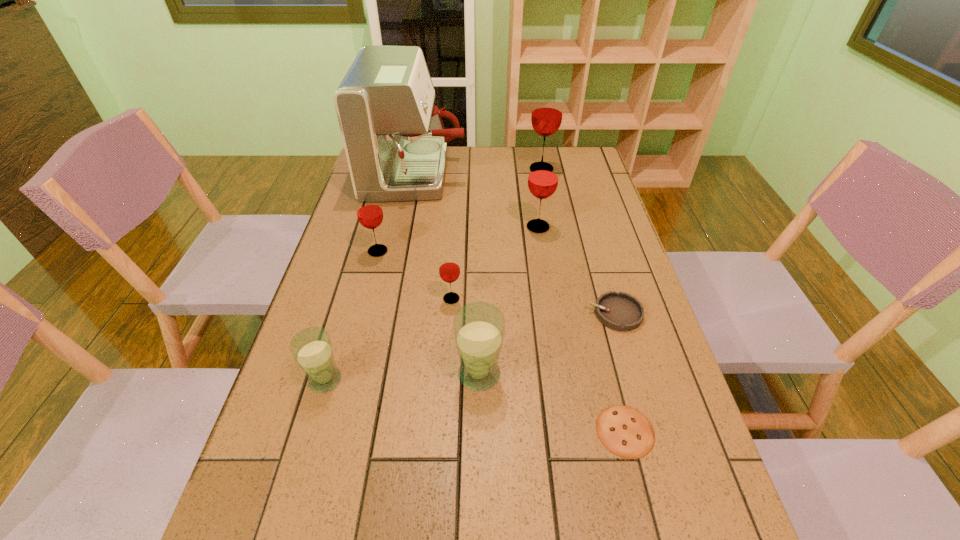
Locate an element on the screen. This screenshot has height=540, width=960. the third nearest glass is located at coordinates (449, 269).

This screenshot has width=960, height=540. In order to click on the smaller blue glass in this screenshot , I will do `click(312, 349)`.

At what (x,y) coordinates should I click in order to perform the action: click on the eighth tallest object. Please return your answer as a coordinate pair (x, y). This screenshot has height=540, width=960. Looking at the image, I should click on (621, 311).

In order to click on gray ashtray in this screenshot , I will do `click(621, 311)`.

You are a GUI agent. You are given a task and a screenshot of the screen. Output one action in this format:
    pyautogui.click(x=<x>, y=<y>)
    Task: Click on the shortest object
    The height and width of the screenshot is (540, 960).
    Given the screenshot: What is the action you would take?
    pyautogui.click(x=623, y=430)

Where is `cookie`? The height and width of the screenshot is (540, 960). cookie is located at coordinates (623, 430).

You are a GUI agent. You are given a task and a screenshot of the screen. Output one action in this format:
    pyautogui.click(x=<x>, y=<y>)
    Task: Click on the blank area located on the front of the coffee maker near the spout
    The height and width of the screenshot is (540, 960).
    Given the screenshot: What is the action you would take?
    pyautogui.click(x=524, y=174)

What are the coordinates of `free space located 0.160m on the front of the farthest red glass` in the screenshot? It's located at (547, 202).

Identify the location of free location located 0.390m on the left of the second tallest glass. (397, 227).

Identify the location of vacant point located 0.320m on the front of the third biggest red glass. (352, 351).